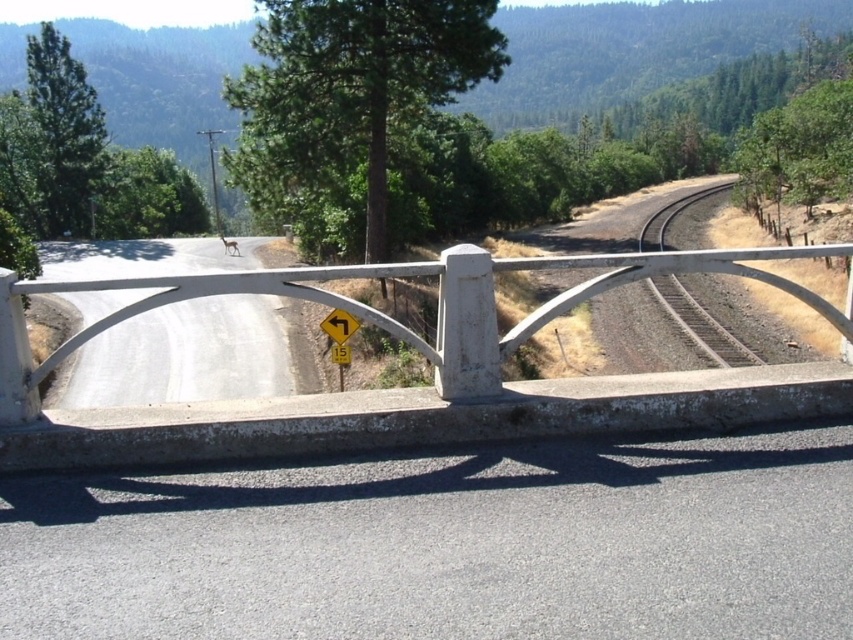
Does brown gravel track at right appear over yellow plastic traffic sign at center?

Yes, brown gravel track at right is above yellow plastic traffic sign at center.

Is point (699, 340) positioned before point (329, 317)?

That is False.

Between point (675, 208) and point (338, 342), which one is positioned in front?

Point (338, 342) is more forward.

The image size is (853, 640). I want to click on brown gravel track at right, so click(700, 324).

Can you confirm if white concrete bridge at center is taller than yellow plastic traffic sign at center?

Yes, white concrete bridge at center is taller than yellow plastic traffic sign at center.

Does point (656, 253) come closer to viewer compared to point (344, 332)?

Yes, point (656, 253) is closer to viewer.

Describe the element at coordinates (387, 316) in the screenshot. The height and width of the screenshot is (640, 853). I see `white concrete bridge at center` at that location.

Find the location of a particular element. This screenshot has width=853, height=640. white concrete bridge at center is located at coordinates (387, 316).

Is white concrete bridge at center positioned before brown gravel track at right?

Yes, white concrete bridge at center is closer to the viewer.

Is white concrete bridge at center wider than brown gravel track at right?

Incorrect, white concrete bridge at center's width does not surpass brown gravel track at right's.

Locate an element on the screen. The image size is (853, 640). white concrete bridge at center is located at coordinates (387, 316).